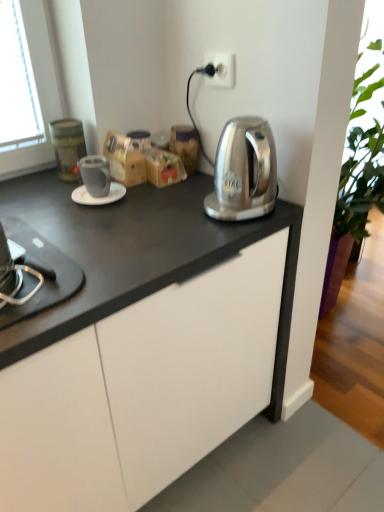
Where is `empty space that is ontop of white matte cabinet at center, placed as the 2th cabinetry when sorted from right to left (from a real-world perspective)`? Image resolution: width=384 pixels, height=512 pixels. empty space that is ontop of white matte cabinet at center, placed as the 2th cabinetry when sorted from right to left (from a real-world perspective) is located at coordinates (90, 221).